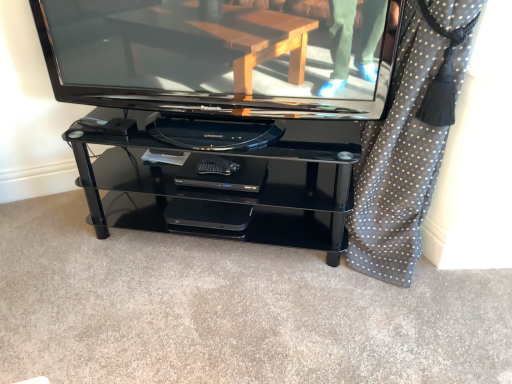
Locate an element on the screen. This screenshot has width=512, height=384. free space to the left of polka dot fabric at right is located at coordinates (301, 296).